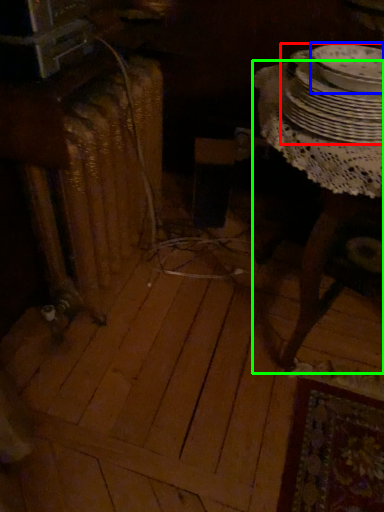
Question: Estimate the real-world distances between objects in this image. Which object is closer to tableware (highlighted by a red box), tableware (highlighted by a blue box) or table (highlighted by a green box)?

Choices:
 (A) tableware
 (B) table

Answer: (A)